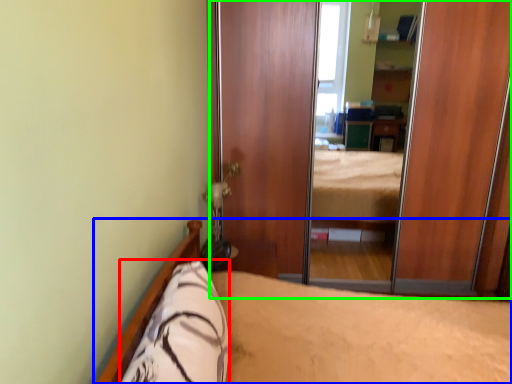
Question: Which is nearer to the pillow (highlighted by a red box)? bed (highlighted by a blue box) or screen door (highlighted by a green box).

Choices:
 (A) bed
 (B) screen door

Answer: (A)